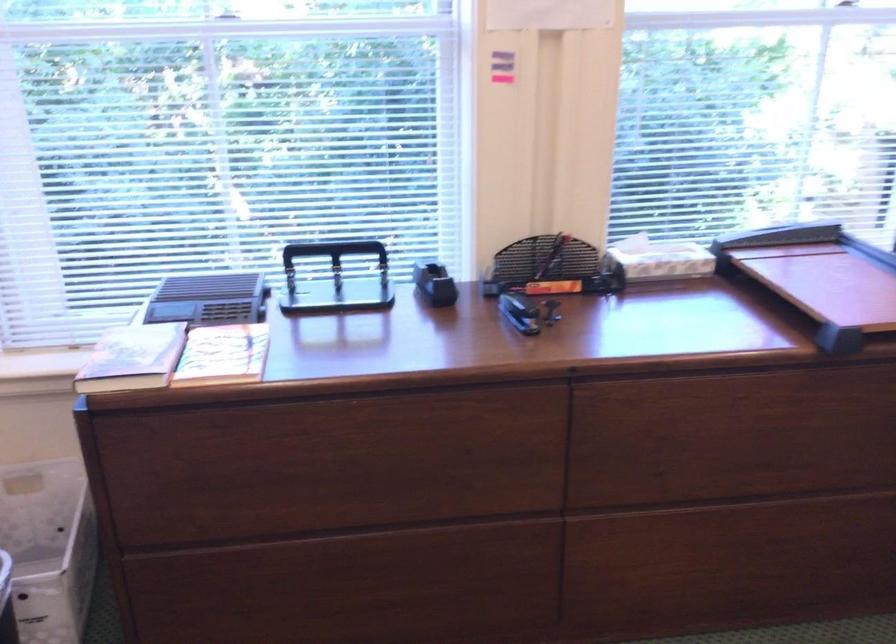
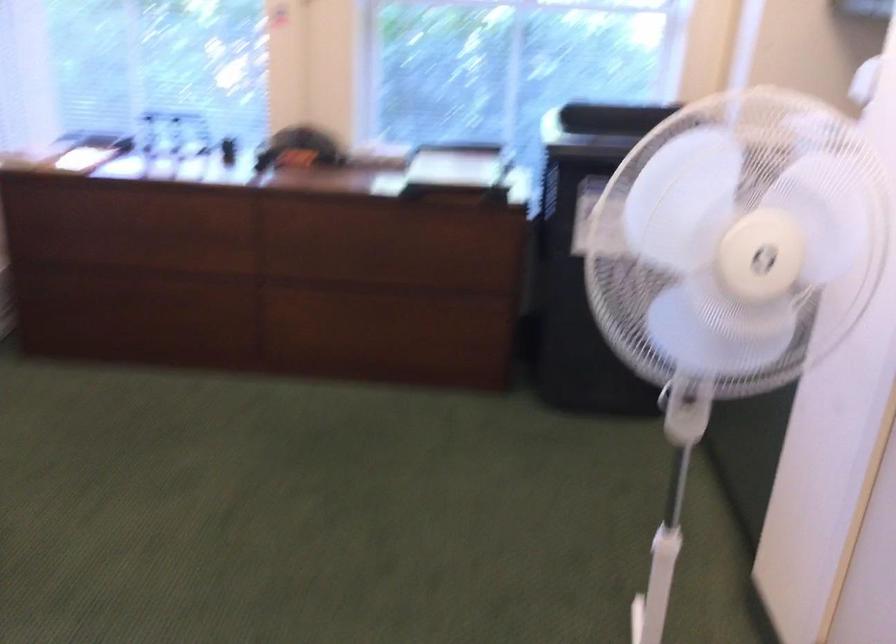
Which direction would the cameraman need to move to produce the second image?

The cameraman moved toward right, backward.